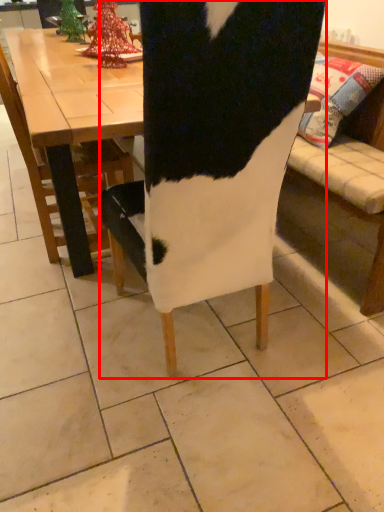
Question: From the image's perspective, where is chair (annotated by the red box) located in relation to chair in the image?

Choices:
 (A) above
 (B) below

Answer: (B)